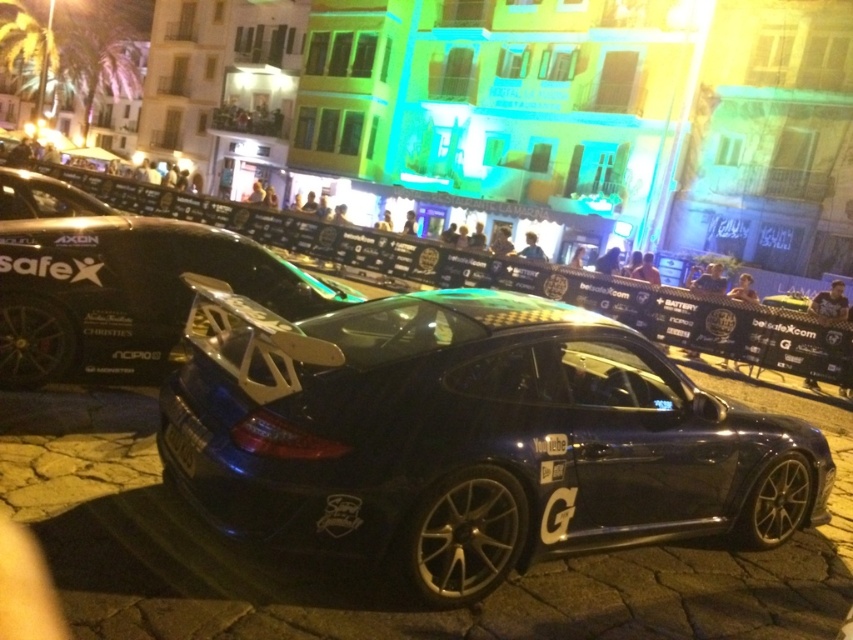
You are a photographer setting up a camera on a tripod to capture both the glossy carbon fiber sports car at center and the glossy carbon fiber car at center. Which car should you adjust the camera angle upwards to focus on?

You should adjust the camera angle upwards to focus on the glossy carbon fiber sports car at center because it has a greater height compared to the glossy carbon fiber car at center.